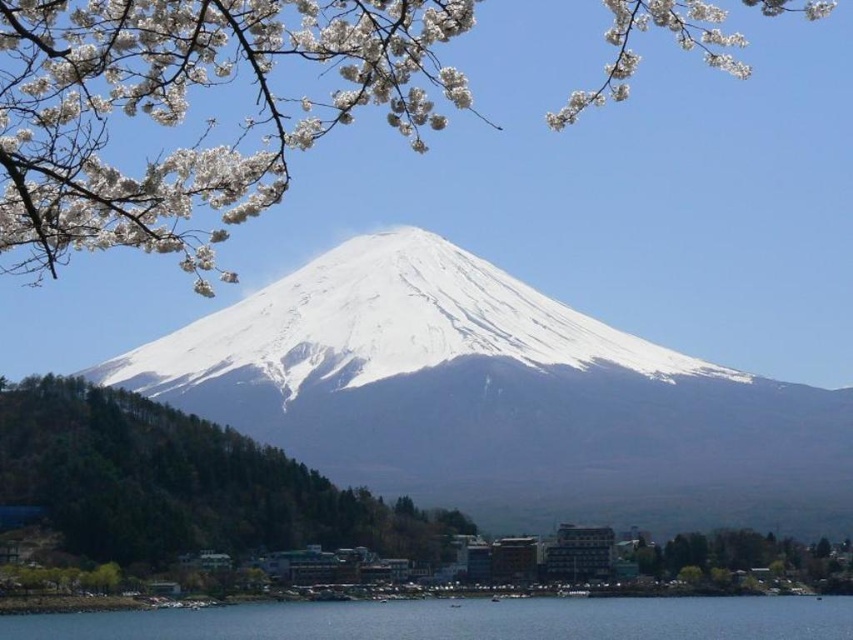
You are standing in the landscape and want to take a photo of both point (93, 460) and point (219, 625). Which point should you focus on first to ensure both are in focus?

You should focus on point (219, 625) first because it is further away from you than point (93, 460), ensuring both will be in focus.

You are standing in the landscape scene and want to walk from the green leafy tree at lower left to the clear blue water at lower center. Which direction should you head towards?

The green leafy tree at lower left is to the left of clear blue water at lower center. To reach the clear blue water at lower center from the green leafy tree at lower left, you should head towards the right.